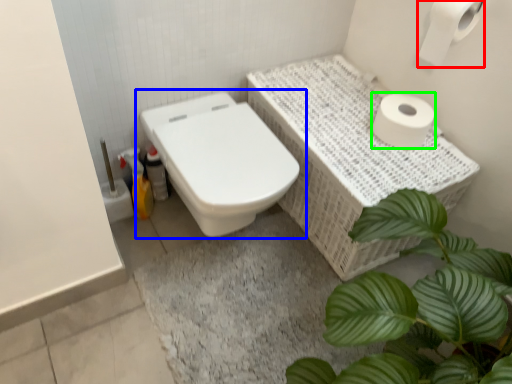
Question: Considering the real-world distances, which object is closest to toilet paper (highlighted by a red box)? toilet (highlighted by a blue box) or toilet paper (highlighted by a green box).

Choices:
 (A) toilet
 (B) toilet paper

Answer: (B)